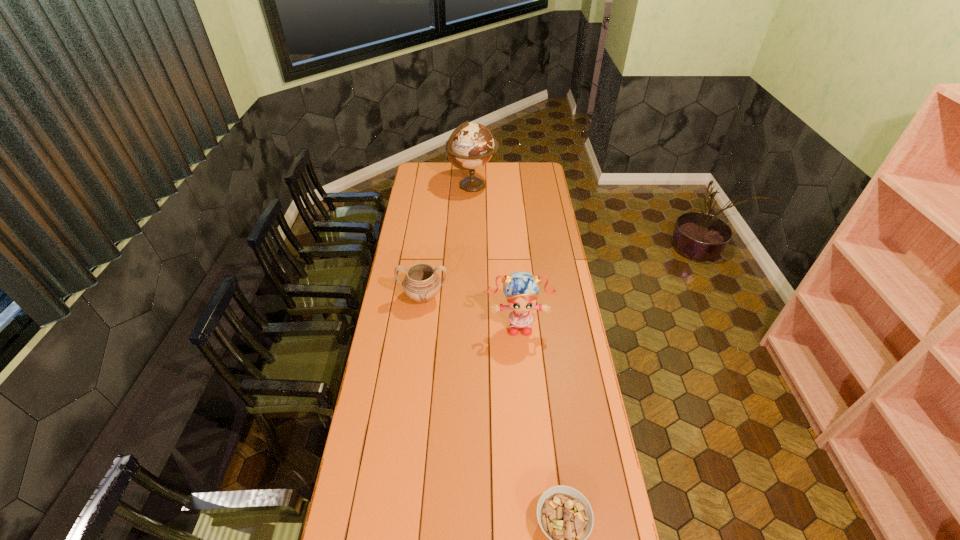
Find the location of a particular element. The image size is (960, 540). blank space at the left edge of the desktop is located at coordinates (374, 398).

I want to click on vacant region at the right edge of the desktop, so click(555, 210).

At what (x,y) coordinates should I click in order to perform the action: click on vacant point at the far left corner. Please return your answer as a coordinate pair (x, y). Image resolution: width=960 pixels, height=540 pixels. Looking at the image, I should click on (419, 162).

I want to click on free space between the third tallest object and the doll, so point(470,310).

I want to click on free space between the third tallest object and the globe, so click(x=448, y=241).

The width and height of the screenshot is (960, 540). I want to click on free area in between the second tallest object and the third tallest object, so click(470, 310).

Find the location of a particular element. Image resolution: width=960 pixels, height=540 pixels. the third closest object to the stew is located at coordinates (471, 144).

Identify which object is the closest to the globe. Please provide its 2D coordinates. Your answer should be formatted as a tuple, i.e. [(x, y)], where the tuple contains the x and y coordinates of a point satisfying the conditions above.

[(421, 283)]